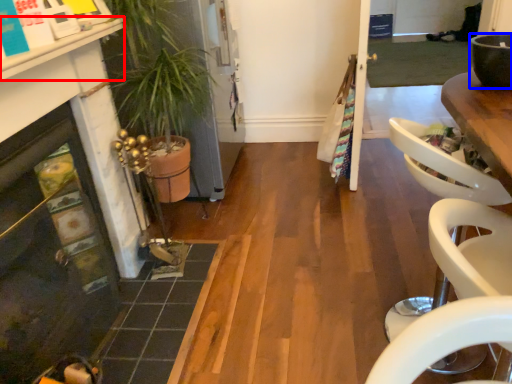
Question: Which point is closer to the camera, counter top (highlighted by a red box) or bowl (highlighted by a blue box)?

Choices:
 (A) counter top
 (B) bowl

Answer: (A)